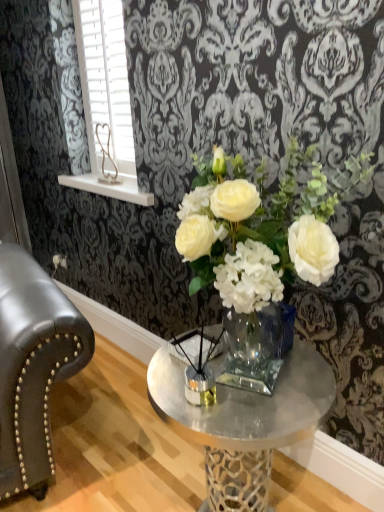
The image size is (384, 512). Describe the element at coordinates (244, 422) in the screenshot. I see `clear glass vase at center` at that location.

In order to face clear glass vase at center, should I rotate leftwards or rightwards?

A 4.938 degree turn to the right will do.

Measure the distance between clear glass vase at center and camera.

They are 36.96 inches apart.

Find the location of a particular element. Image resolution: width=384 pixels, height=512 pixels. clear glass vase at center is located at coordinates (244, 422).

Where is `white plastic blinds at upper left`? white plastic blinds at upper left is located at coordinates coord(105,100).

The image size is (384, 512). Describe the element at coordinates (105, 100) in the screenshot. I see `white plastic blinds at upper left` at that location.

Identify the location of clear glass vase at center. (244, 422).

Is white plastic blinds at upper left to the left of clear glass vase at center from the viewer's perspective?

Correct, you'll find white plastic blinds at upper left to the left of clear glass vase at center.

Considering the relative positions of white plastic blinds at upper left and clear glass vase at center in the image provided, is white plastic blinds at upper left behind clear glass vase at center?

That is True.

Which is closer to the camera, (x=99, y=138) or (x=261, y=398)?

Point (x=99, y=138) is positioned farther from the camera compared to point (x=261, y=398).

From the image's perspective, between white plastic blinds at upper left and clear glass vase at center, which one is located above?

white plastic blinds at upper left appears higher in the image.

From a real-world perspective, is white plastic blinds at upper left above or below clear glass vase at center?

white plastic blinds at upper left is situated higher than clear glass vase at center in the real world.

Considering the sizes of objects white plastic blinds at upper left and clear glass vase at center in the image provided, who is wider, white plastic blinds at upper left or clear glass vase at center?

clear glass vase at center.

In terms of height, does white plastic blinds at upper left look taller or shorter compared to clear glass vase at center?

Clearly, white plastic blinds at upper left is taller compared to clear glass vase at center.

Considering the sizes of objects white plastic blinds at upper left and clear glass vase at center in the image provided, who is bigger, white plastic blinds at upper left or clear glass vase at center?

With larger size is clear glass vase at center.

Can clear glass vase at center be found inside white plastic blinds at upper left?

No, clear glass vase at center is located outside of white plastic blinds at upper left.

Is the surface of white plastic blinds at upper left in direct contact with clear glass vase at center?

No.

Is white plastic blinds at upper left oriented away from clear glass vase at center?

No.

What's the angular difference between white plastic blinds at upper left and clear glass vase at center's facing directions?

The angular difference between white plastic blinds at upper left and clear glass vase at center is 0.00425 degrees.

This screenshot has height=512, width=384. Identify the location of window on the left of clear glass vase at center. (105, 100).

Which object is positioned more to the left, clear glass vase at center or white plastic blinds at upper left?

Positioned to the left is white plastic blinds at upper left.

Which object is further away from the camera taking this photo, clear glass vase at center or white plastic blinds at upper left?

white plastic blinds at upper left is behind.

Does point (238, 444) lie behind point (107, 88)?

No, it is in front of (107, 88).

From the image's perspective, is clear glass vase at center positioned above or below white plastic blinds at upper left?

From the image's perspective, clear glass vase at center appears below white plastic blinds at upper left.

From a real-world perspective, is clear glass vase at center positioned above or below white plastic blinds at upper left?

clear glass vase at center is situated lower than white plastic blinds at upper left in the real world.

Which object is wider, clear glass vase at center or white plastic blinds at upper left?

clear glass vase at center is wider.

Who is shorter, clear glass vase at center or white plastic blinds at upper left?

clear glass vase at center.

In the scene shown: In terms of size, does clear glass vase at center appear bigger or smaller than white plastic blinds at upper left?

Clearly, clear glass vase at center is larger in size than white plastic blinds at upper left.

Can we say clear glass vase at center lies outside white plastic blinds at upper left?

Indeed, clear glass vase at center is completely outside white plastic blinds at upper left.

Looking at this image, does clear glass vase at center touch white plastic blinds at upper left?

clear glass vase at center is not next to white plastic blinds at upper left, and they're not touching.

Is white plastic blinds at upper left at the back of clear glass vase at center?

No, clear glass vase at center's orientation is not away from white plastic blinds at upper left.

Can you tell me how much clear glass vase at center and white plastic blinds at upper left differ in facing direction?

clear glass vase at center and white plastic blinds at upper left are facing 0.00425 degrees away from each other.

Measure the distance from clear glass vase at center to white plastic blinds at upper left.

The distance of clear glass vase at center from white plastic blinds at upper left is 4.02 feet.

Locate an element on the screen. window above the clear glass vase at center (from the image's perspective) is located at coordinates (105, 100).

Find the location of `window on the left of clear glass vase at center`. window on the left of clear glass vase at center is located at coordinates (105, 100).

Find the location of `window located above the clear glass vase at center (from a real-world perspective)`. window located above the clear glass vase at center (from a real-world perspective) is located at coordinates (105, 100).